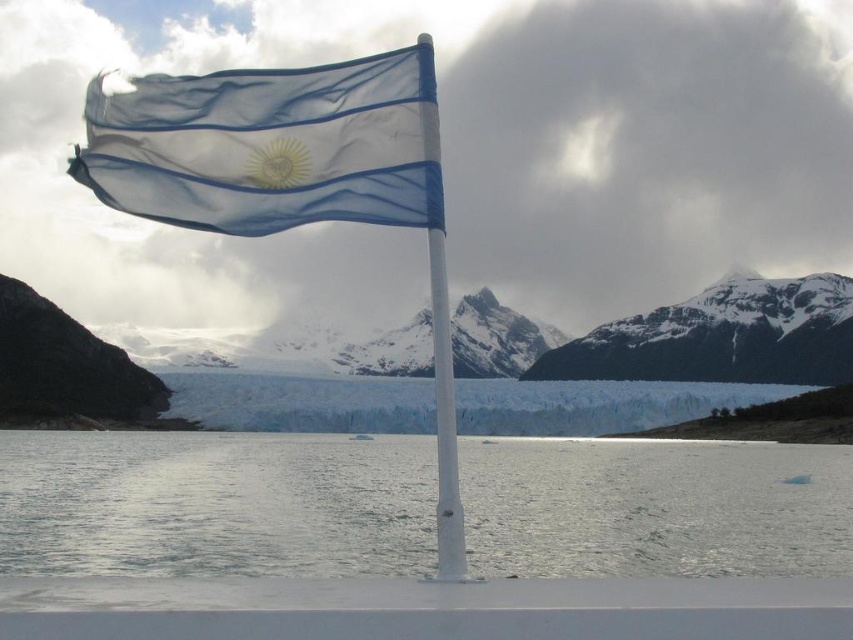
How far apart are white plastic flag pole at center and snowy granite mountain at center?

The distance of white plastic flag pole at center from snowy granite mountain at center is 392.71 meters.

Is white plastic flag pole at center above snowy granite mountain at center?

Yes.

Does point (207, 205) lie behind point (543, 339)?

No, (207, 205) is in front of (543, 339).

Find the location of a particular element. This screenshot has height=640, width=853. white plastic flag pole at center is located at coordinates (289, 177).

Which is below, snowy granite mountain at upper center or snowy granite mountain at center?

snowy granite mountain at center is below.

Is snowy granite mountain at upper center smaller than snowy granite mountain at center?

Actually, snowy granite mountain at upper center might be larger than snowy granite mountain at center.

Who is more distant from viewer, (833, 324) or (392, 330)?

Point (833, 324)

Image resolution: width=853 pixels, height=640 pixels. Identify the location of snowy granite mountain at upper center. (722, 337).

Can you confirm if translucent fabric flag at upper center is positioned above snowy granite mountain at upper center?

Indeed, translucent fabric flag at upper center is positioned over snowy granite mountain at upper center.

Is point (248, 205) positioned before point (824, 282)?

Yes, it is in front of point (824, 282).

The height and width of the screenshot is (640, 853). In order to click on translucent fabric flag at upper center in this screenshot , I will do `click(270, 145)`.